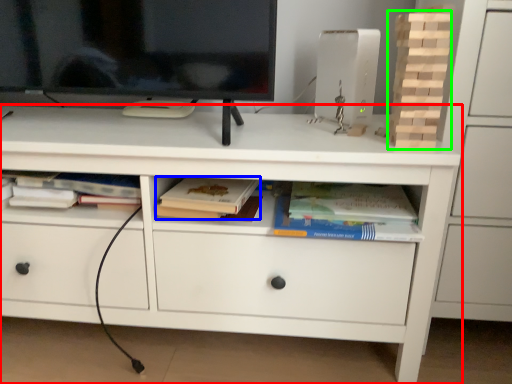
Question: Considering the real-world distances, which object is farthest from chest of drawers (highlighted by a red box)? paperback book (highlighted by a blue box) or book (highlighted by a green box)?

Choices:
 (A) paperback book
 (B) book

Answer: (B)